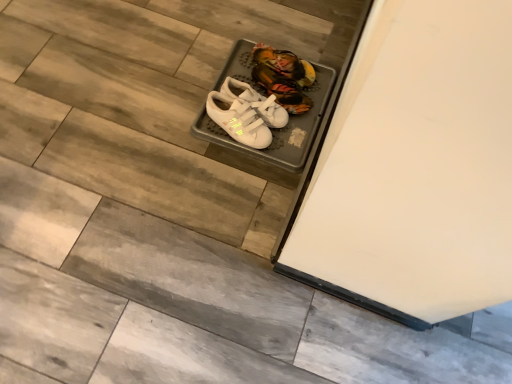
Question: Is point (274, 59) positioned closer to the camera than point (272, 117)?

Choices:
 (A) closer
 (B) farther

Answer: (B)

Question: Would you say white velcro sneakers at center, the 3th footwear when ordered from front to back, is inside or outside white matte sneakers at center, positioned as the 2th footwear in front-to-back order?

Choices:
 (A) inside
 (B) outside

Answer: (B)

Question: Which object is the farthest from the white velcro sneakers at center, which is the first footwear in back-to-front order?

Choices:
 (A) white matte sneakers at center, which is the 2th footwear in back-to-front order
 (B) white velcro sneakers at center, which appears as the third footwear when viewed from the back

Answer: (B)

Question: Estimate the real-world distances between objects in this image. Which object is farther from the white matte sneakers at center, positioned as the 2th footwear in front-to-back order?

Choices:
 (A) white velcro sneakers at center, positioned as the 1th footwear in front-to-back order
 (B) white velcro sneakers at center, the 3th footwear when ordered from front to back

Answer: (B)